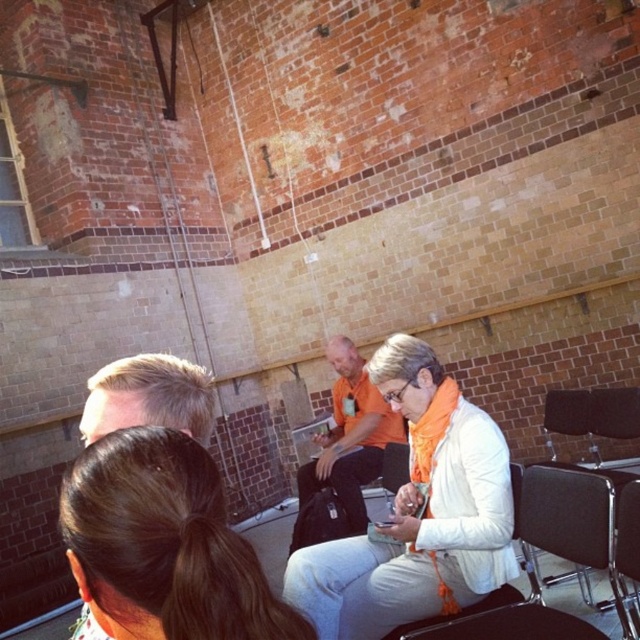
Which is above, orange cotton shirt at center or black leather chair at lower right?

orange cotton shirt at center is above.

Is orange cotton shirt at center positioned in front of black leather chair at lower right?

No, it is not.

Find the location of a particular element. orange cotton shirt at center is located at coordinates (416, 513).

The image size is (640, 640). What are the coordinates of `orange cotton shirt at center` in the screenshot? It's located at (416, 513).

Does point (326, 593) lie in front of point (605, 496)?

No.

Between point (349, 602) and point (609, 548), which one is positioned in front?

Point (609, 548)

Is point (458, 540) positioned in front of point (532, 540)?

Yes.

Find the location of a particular element. This screenshot has height=640, width=640. orange cotton shirt at center is located at coordinates (416, 513).

Which is more to the right, orange fabric shirt at center or black leather chair at lower right?

Positioned to the right is black leather chair at lower right.

Is orange fabric shirt at center bigger than black leather chair at lower right?

Yes, orange fabric shirt at center is bigger than black leather chair at lower right.

Image resolution: width=640 pixels, height=640 pixels. Describe the element at coordinates (346, 451) in the screenshot. I see `orange fabric shirt at center` at that location.

At what (x,y) coordinates should I click in order to perform the action: click on orange fabric shirt at center. Please return your answer as a coordinate pair (x, y). The width and height of the screenshot is (640, 640). Looking at the image, I should click on (346, 451).